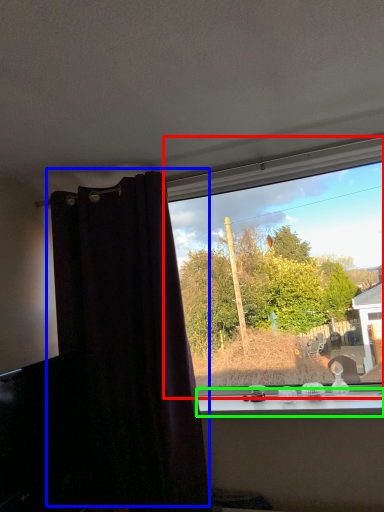
Question: Considering the real-world distances, which object is farthest from window (highlighted by a red box)? curtain (highlighted by a blue box) or window sill (highlighted by a green box)?

Choices:
 (A) curtain
 (B) window sill

Answer: (A)